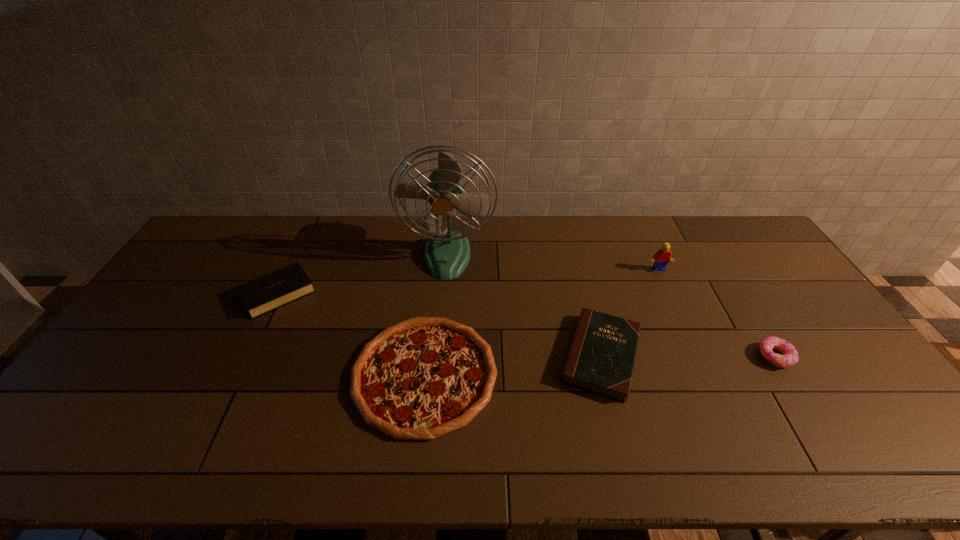
Locate which object is the third closest to the leftmost object. Please provide its 2D coordinates. Your answer should be formatted as a tuple, i.e. [(x, y)], where the tuple contains the x and y coordinates of a point satisfying the conditions above.

[(601, 357)]

This screenshot has width=960, height=540. What are the coordinates of `vacant space that satisfies the following two spatial constraints: 1. in front of the fan, directing airflow; 2. on the left side of the rightmost object` in the screenshot? It's located at (439, 356).

At what (x,y) coordinates should I click in order to perform the action: click on free space that satisfies the following two spatial constraints: 1. on the front-facing side of the Lego; 2. on the right side of the rightmost object. Please return your answer as a coordinate pair (x, y). The height and width of the screenshot is (540, 960). Looking at the image, I should click on (697, 356).

This screenshot has width=960, height=540. I want to click on free region that satisfies the following two spatial constraints: 1. on the front-facing side of the rightmost object; 2. on the left side of the fifth object from left to right, so click(697, 356).